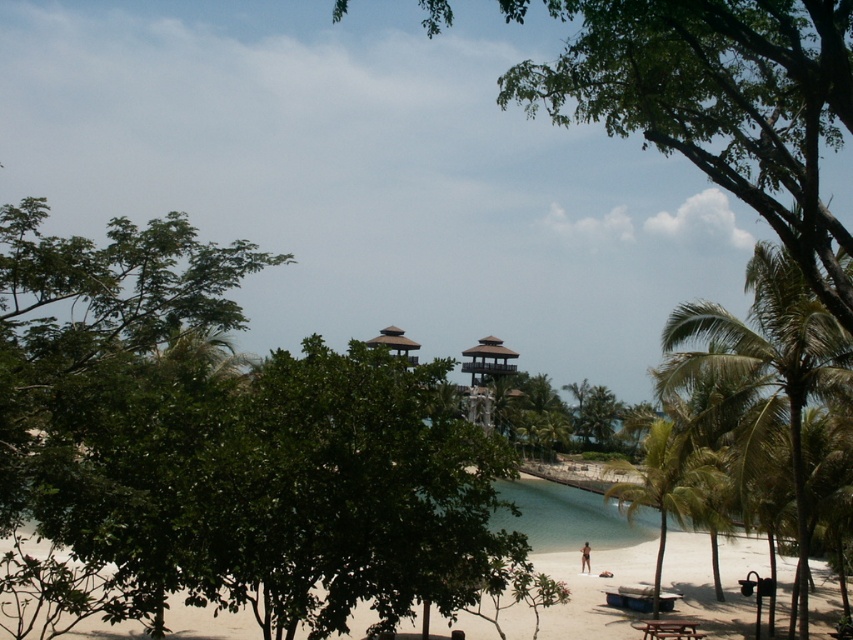
Consider the image. You are a person with a 1.5 meter long surfboard. You want to walk from the picnic area to the water. Is there enough space between the green leafy palm tree at right and the brown skin at lower center to carry your surfboard horizontally?

The green leafy palm tree at right is bigger than brown skin at lower center. Since the surfboard is 1.5 meters long, the space between them may be sufficient if the distance between the two objects is at least 1.5 meters. However, without knowing the exact distance, it is uncertain. Please check the actual space available.